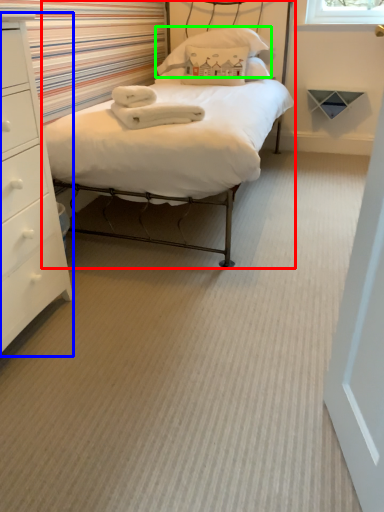
Question: Considering the real-world distances, which object is closest to bed (highlighted by a red box)? chest of drawers (highlighted by a blue box) or pillow (highlighted by a green box).

Choices:
 (A) chest of drawers
 (B) pillow

Answer: (A)